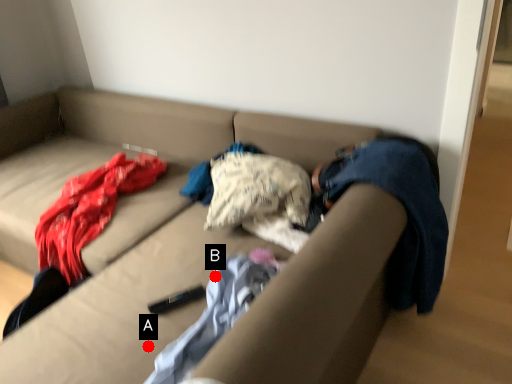
Question: Two points are circled on the image, labeled by A and B beside each circle. Which point appears farthest from the camera in this image?

Choices:
 (A) A is further
 (B) B is further

Answer: (B)